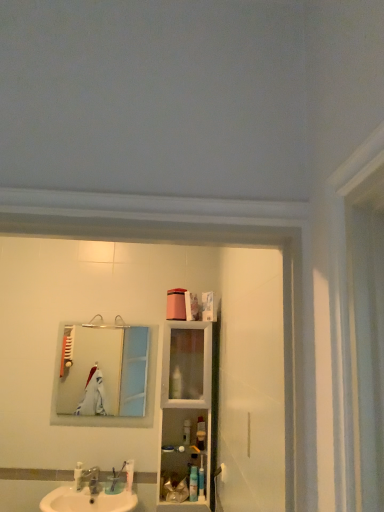
Question: Does translucent plastic container at center, the fourth toiletry positioned from the right, have a greater width compared to brushed metal faucet at sink front?

Choices:
 (A) no
 (B) yes

Answer: (A)

Question: Would you say translucent plastic container at center, the fourth toiletry positioned from the right, contains brushed metal faucet at sink front?

Choices:
 (A) no
 (B) yes

Answer: (A)

Question: Is translucent plastic container at center, which is the 2th toiletry in left-to-right order, placed right next to brushed metal faucet at sink front?

Choices:
 (A) yes
 (B) no

Answer: (B)

Question: From a real-world perspective, is translucent plastic container at center, the fourth toiletry positioned from the right, over brushed metal faucet at sink front?

Choices:
 (A) yes
 (B) no

Answer: (A)

Question: Is translucent plastic container at center, the fourth toiletry positioned from the right, closer to the viewer compared to brushed metal faucet at sink front?

Choices:
 (A) no
 (B) yes

Answer: (A)

Question: Relative to brushed metal faucet at sink front, is blue plastic toothpaste tube at lower center, the 3th toiletry when ordered from left to right, in front or behind?

Choices:
 (A) front
 (B) behind

Answer: (A)

Question: Considering the positions of blue plastic toothpaste tube at lower center, marked as the 3th toiletry in a right-to-left arrangement, and brushed metal faucet at sink front in the image, is blue plastic toothpaste tube at lower center, marked as the 3th toiletry in a right-to-left arrangement, wider or thinner than brushed metal faucet at sink front?

Choices:
 (A) thin
 (B) wide

Answer: (A)

Question: Looking at the image, does blue plastic toothpaste tube at lower center, the 3th toiletry when ordered from left to right, seem bigger or smaller compared to brushed metal faucet at sink front?

Choices:
 (A) small
 (B) big

Answer: (A)

Question: In terms of height, does blue plastic toothpaste tube at lower center, marked as the 3th toiletry in a right-to-left arrangement, look taller or shorter compared to brushed metal faucet at sink front?

Choices:
 (A) short
 (B) tall

Answer: (B)

Question: Is white glossy sink at lower left to the left or to the right of brushed metal faucet at sink front in the image?

Choices:
 (A) left
 (B) right

Answer: (B)

Question: Is point (76, 497) positioned closer to the camera than point (74, 475)?

Choices:
 (A) farther
 (B) closer

Answer: (B)

Question: From the image's perspective, is white glossy sink at lower left located above or below brushed metal faucet at sink front?

Choices:
 (A) above
 (B) below

Answer: (B)

Question: From a real-world perspective, is white glossy sink at lower left above or below brushed metal faucet at sink front?

Choices:
 (A) below
 (B) above

Answer: (A)

Question: Considering the relative positions of silver metallic mirror at upper left and white glossy sink at lower left in the image provided, is silver metallic mirror at upper left to the left or to the right of white glossy sink at lower left?

Choices:
 (A) right
 (B) left

Answer: (A)

Question: From a real-world perspective, is silver metallic mirror at upper left physically located above or below white glossy sink at lower left?

Choices:
 (A) above
 (B) below

Answer: (A)